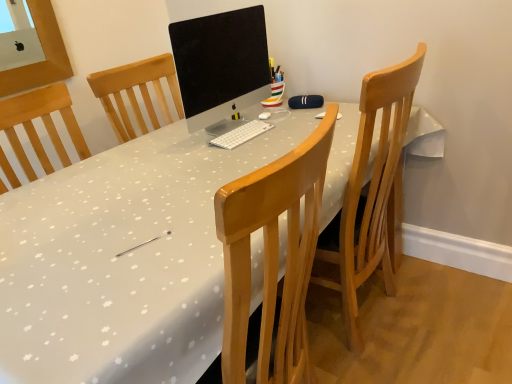
Question: From a real-world perspective, is light brown wooden chair at center positioned above or below white glossy desk at center?

Choices:
 (A) below
 (B) above

Answer: (B)

Question: Based on their sizes in the image, would you say light brown wooden chair at center is bigger or smaller than white glossy desk at center?

Choices:
 (A) big
 (B) small

Answer: (B)

Question: Estimate the real-world distances between objects in this image. Which object is closer to the matte black monitor at center?

Choices:
 (A) white glossy desk at center
 (B) light brown wooden chair at center

Answer: (A)

Question: Which object is the farthest from the light brown wooden chair at center?

Choices:
 (A) matte black monitor at center
 (B) white glossy desk at center

Answer: (A)